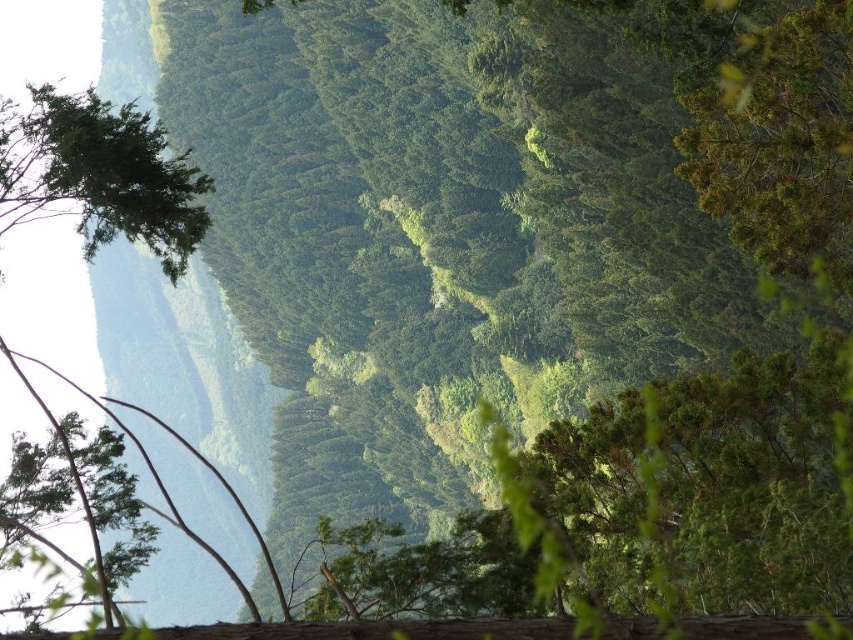
Based on the scene description, where is the green leafy tree at upper left located in terms of coordinates?

The green leafy tree at upper left is located at coordinates point [99,173].

You are an environmental scientist examining the forest structure. You notice the green leafy tree at upper left and the green leafy tree at left. Which tree would likely cast a larger shadow on the forest floor during midday when the sun is directly overhead?

The green leafy tree at upper left would cast a larger shadow because it has a larger size compared to the green leafy tree at left.